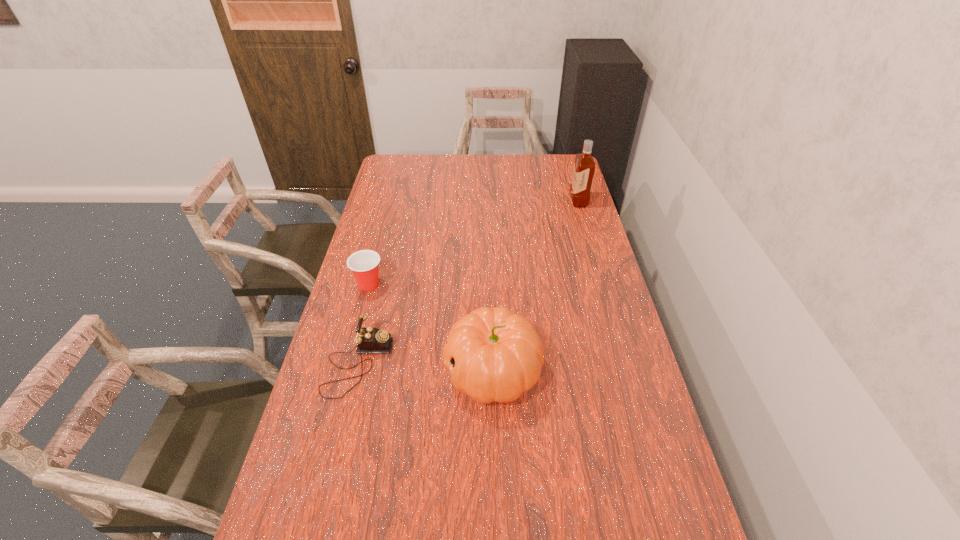
The height and width of the screenshot is (540, 960). In order to click on vacant space situated 0.310m on the carved face of the second object from right to left in this screenshot , I will do `click(338, 370)`.

I want to click on vacant space located on the carved face of the second object from right to left, so click(x=410, y=370).

Find the location of `free space located 0.160m on the back of the third nearest object`. free space located 0.160m on the back of the third nearest object is located at coordinates (379, 246).

Where is `vacant space located 0.100m on the dial of the telephone`? The height and width of the screenshot is (540, 960). vacant space located 0.100m on the dial of the telephone is located at coordinates (422, 364).

This screenshot has width=960, height=540. Find the location of `cup that is at the left edge`. cup that is at the left edge is located at coordinates (364, 264).

The image size is (960, 540). In order to click on telephone located at the left edge in this screenshot , I will do `click(369, 340)`.

Locate an element on the screen. Image resolution: width=960 pixels, height=540 pixels. object that is at the right edge is located at coordinates (584, 166).

You are a GUI agent. You are given a task and a screenshot of the screen. Output one action in this format:
    pyautogui.click(x=<x>, y=<y>)
    Task: Click on the vacant space at the far edge of the desktop
    The height and width of the screenshot is (540, 960).
    Given the screenshot: What is the action you would take?
    pyautogui.click(x=508, y=177)

In the image, there is a desktop. At what (x,y) coordinates should I click in order to perform the action: click on free region at the right edge. Please return your answer as a coordinate pair (x, y). Looking at the image, I should click on 568,197.

This screenshot has height=540, width=960. What are the coordinates of `vacant space at the far left corner of the desktop` in the screenshot? It's located at [x=395, y=157].